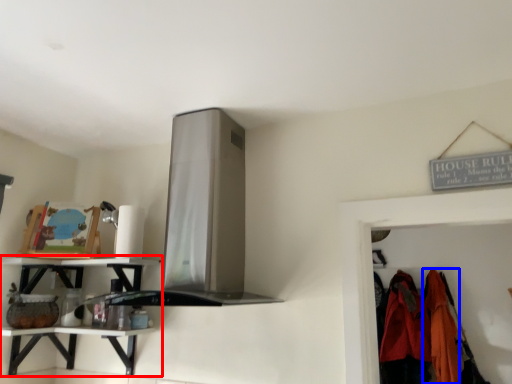
Question: Which point is further to the camera, shelf (highlighted by a red box) or clothing (highlighted by a blue box)?

Choices:
 (A) shelf
 (B) clothing

Answer: (B)